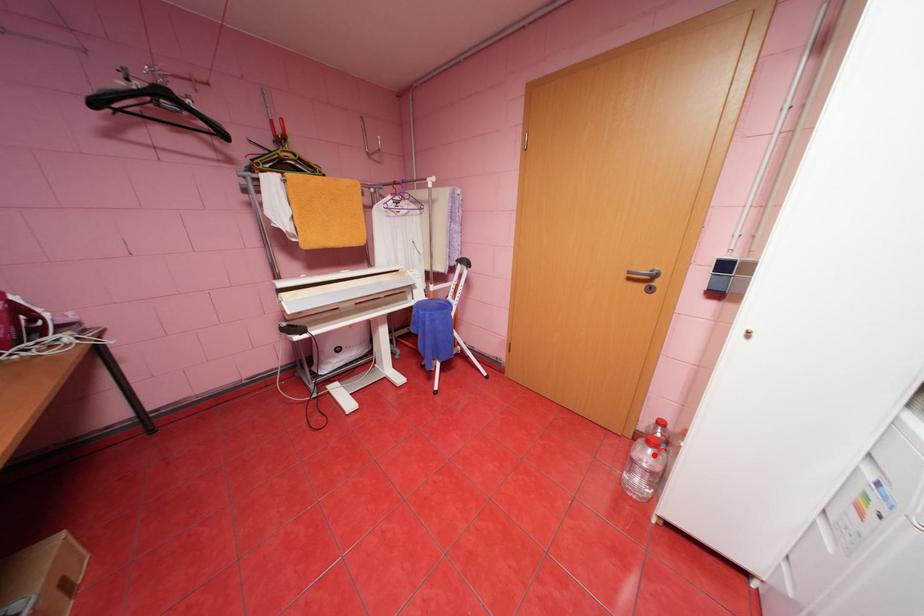
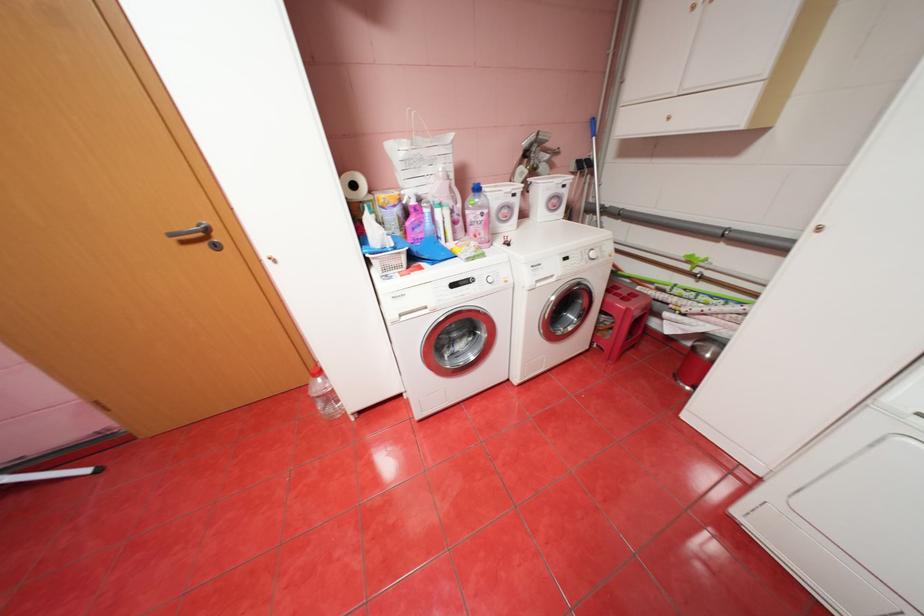
The point at the highlighted location is marked in the first image. Where is the corresponding point in the second image?

(329, 385)